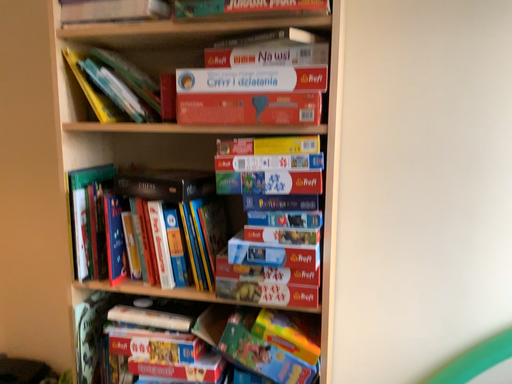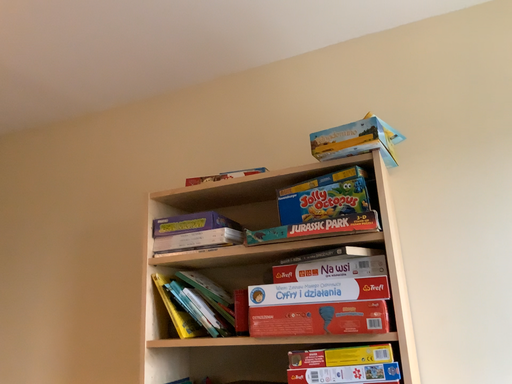
Question: How did the camera likely rotate when shooting the video?

Choices:
 (A) rotated upward
 (B) rotated downward

Answer: (A)